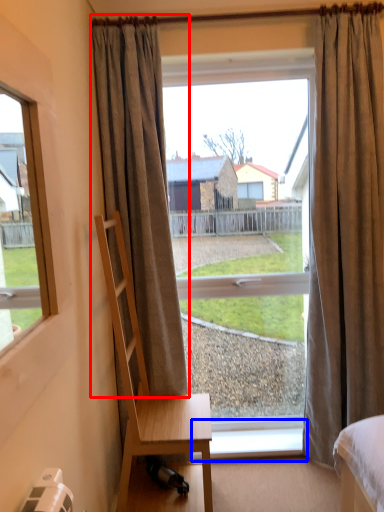
Question: Which point is closer to the camera, curtain (highlighted by a red box) or window sill (highlighted by a blue box)?

Choices:
 (A) curtain
 (B) window sill

Answer: (A)